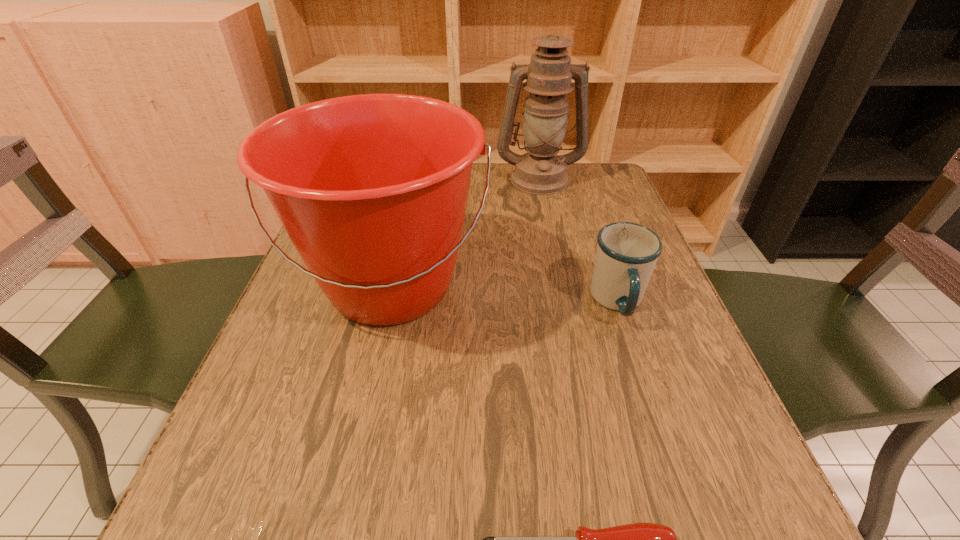
At what (x,y) coordinates should I click in order to perform the action: click on oil lamp. Please return your answer as a coordinate pair (x, y). Looking at the image, I should click on (540, 171).

Locate an element on the screen. Image resolution: width=960 pixels, height=540 pixels. bucket is located at coordinates (372, 189).

In order to click on mug in this screenshot , I will do `click(626, 255)`.

Where is `vacant space located on the left of the oil lamp`? This screenshot has height=540, width=960. vacant space located on the left of the oil lamp is located at coordinates (449, 179).

Locate an element on the screen. Image resolution: width=960 pixels, height=540 pixels. vacant space located 0.170m with the handle attached to the rim of the bucket is located at coordinates (353, 455).

At what (x,y) coordinates should I click in order to perform the action: click on free space located 0.230m on the handle side of the third tallest object. Please return your answer as a coordinate pair (x, y). This screenshot has height=540, width=960. Looking at the image, I should click on (669, 453).

Locate an element on the screen. The height and width of the screenshot is (540, 960). object present at the far edge is located at coordinates (540, 171).

This screenshot has width=960, height=540. I want to click on object that is at the left edge, so click(x=372, y=189).

Where is `oil lamp situated at the right edge`? The image size is (960, 540). oil lamp situated at the right edge is located at coordinates (540, 171).

Locate an element on the screen. This screenshot has height=540, width=960. mug present at the right edge is located at coordinates (626, 255).